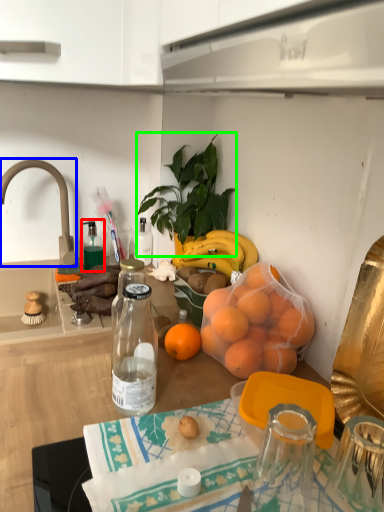
Question: Considering the real-world distances, which object is farthest from bottle (highlighted by a red box)? faucet (highlighted by a blue box) or houseplant (highlighted by a green box)?

Choices:
 (A) faucet
 (B) houseplant

Answer: (B)